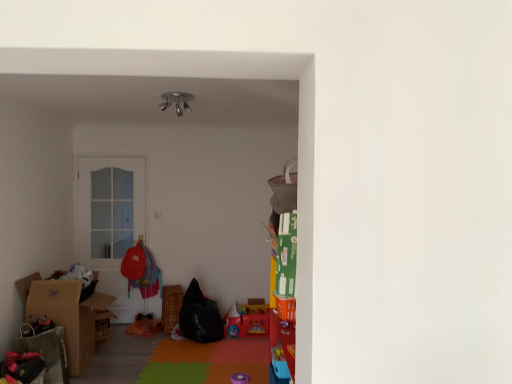
Question: Is point (221, 334) closer or farther from the camera than point (73, 311)?

Choices:
 (A) farther
 (B) closer

Answer: (A)

Question: Is black fabric bean bag at center, which appears as the second bean bag chair when viewed from the top, situated inside brown cardboard box at left or outside?

Choices:
 (A) outside
 (B) inside

Answer: (A)

Question: Which object is the closest to the black fabric bean bag at center, which appears as the second bean bag chair when viewed from the top?

Choices:
 (A) brown cardboard box at left
 (B) gray fabric bean bag chair at upper right, positioned as the 1th bean bag chair in top-to-bottom order
 (C) matte red backpack at center
 (D) woven brown picnic basket at center
 (E) metallic chrome lamp at upper center

Answer: (D)

Question: Which of these objects is positioned farthest from the matte plastic toy at center?

Choices:
 (A) matte red backpack at center
 (B) woven brown picnic basket at center
 (C) brown cardboard box at left
 (D) gray fabric bean bag chair at upper right, the first bean bag chair positioned from the front
 (E) white glass door at center

Answer: (D)